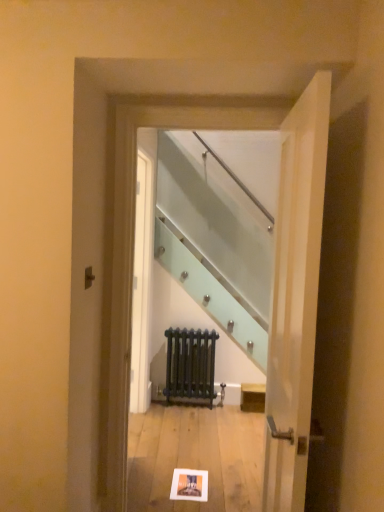
Question: Would you say white paper postcard at center is to the left or to the right of white wood door at right in the picture?

Choices:
 (A) right
 (B) left

Answer: (B)

Question: Looking at their shapes, would you say white paper postcard at center is wider or thinner than white wood door at right?

Choices:
 (A) wide
 (B) thin

Answer: (A)

Question: Based on their relative distances, which object is farther from the white wood door at right?

Choices:
 (A) clear glass staircase at center
 (B) white paper postcard at center
 (C) matte black radiator at center

Answer: (C)

Question: Which of these objects is positioned closest to the clear glass staircase at center?

Choices:
 (A) white wood door at right
 (B) white paper postcard at center
 (C) matte black radiator at center

Answer: (A)